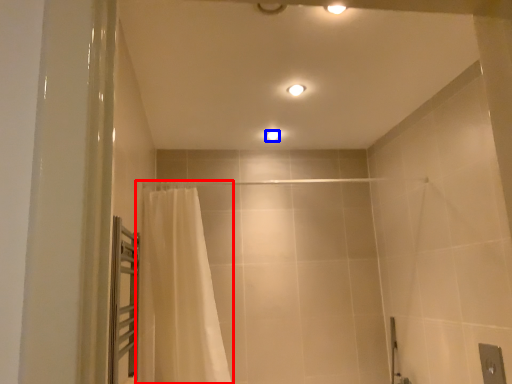
Question: Which object appears farthest to the camera in this image, curtain (highlighted by a red box) or light fixture (highlighted by a blue box)?

Choices:
 (A) curtain
 (B) light fixture

Answer: (B)